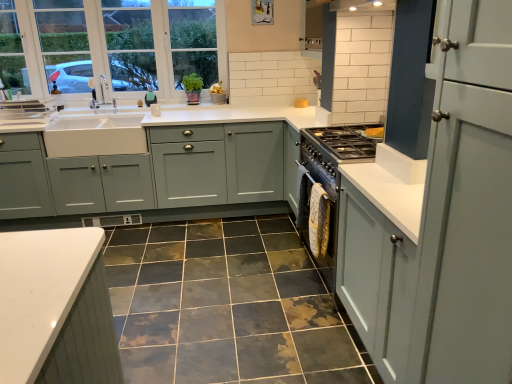
Question: From the image's perspective, is matte gray cabinets at center, arranged as the 1th cabinetry when viewed from the left, positioned above or below matte gray cabinet at right, which is counted as the second cabinetry, starting from the left?

Choices:
 (A) above
 (B) below

Answer: (A)

Question: Visually, is matte gray cabinets at center, the 1th cabinetry when ordered from back to front, positioned to the left or to the right of matte gray cabinet at right, which is counted as the second cabinetry, starting from the left?

Choices:
 (A) right
 (B) left

Answer: (B)

Question: Estimate the real-world distances between objects in this image. Which object is closer to the teal fabric at upper left?

Choices:
 (A) matte gray cabinet at right, which is counted as the second cabinetry, starting from the left
 (B) matte gray cabinets at center, arranged as the 1th cabinetry when viewed from the left
 (C) white ceramic sink at left
 (D) marble-like ceramic tile at center
 (E) white glass window at upper left

Answer: (E)

Question: Estimate the real-world distances between objects in this image. Which object is closer to the white ceramic sink at left?

Choices:
 (A) white glass window at upper left
 (B) matte gray cabinet at right, which is counted as the second cabinetry, starting from the left
 (C) matte gray cabinets at center, arranged as the 1th cabinetry when viewed from the left
 (D) teal fabric at upper left
 (E) marble-like ceramic tile at center

Answer: (C)